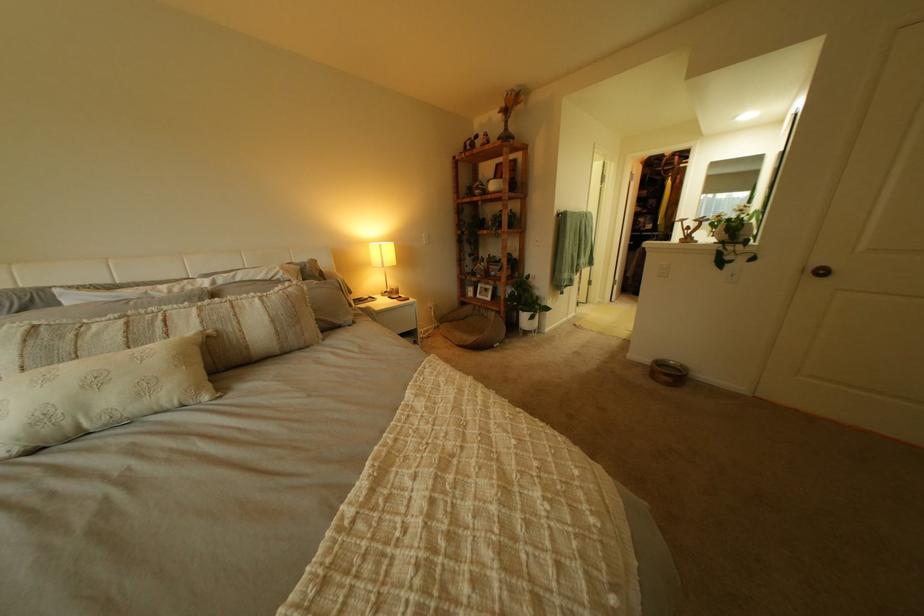
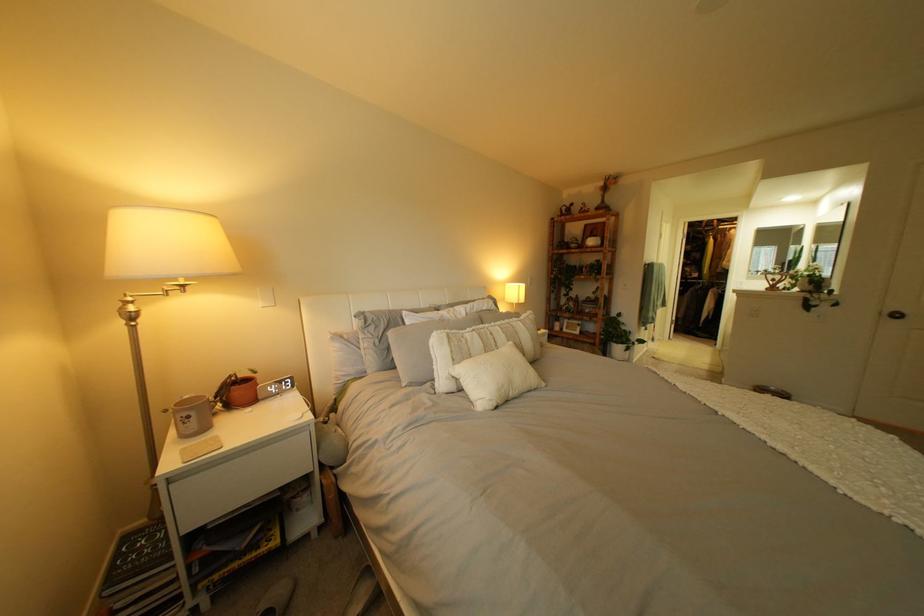
Where in the second image is the point corresponding to (x=213, y=323) from the first image?

(518, 337)